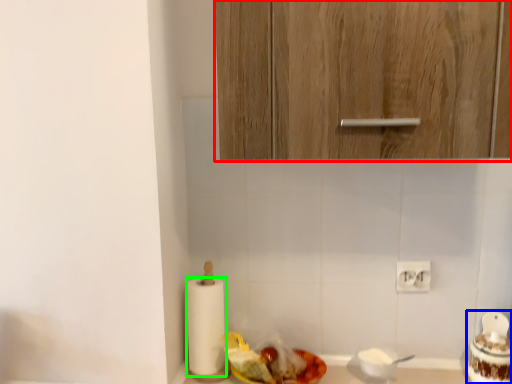
Question: Which is nearer to the cabinetry (highlighted by a red box)? food (highlighted by a blue box) or paper towel (highlighted by a green box).

Choices:
 (A) food
 (B) paper towel

Answer: (B)